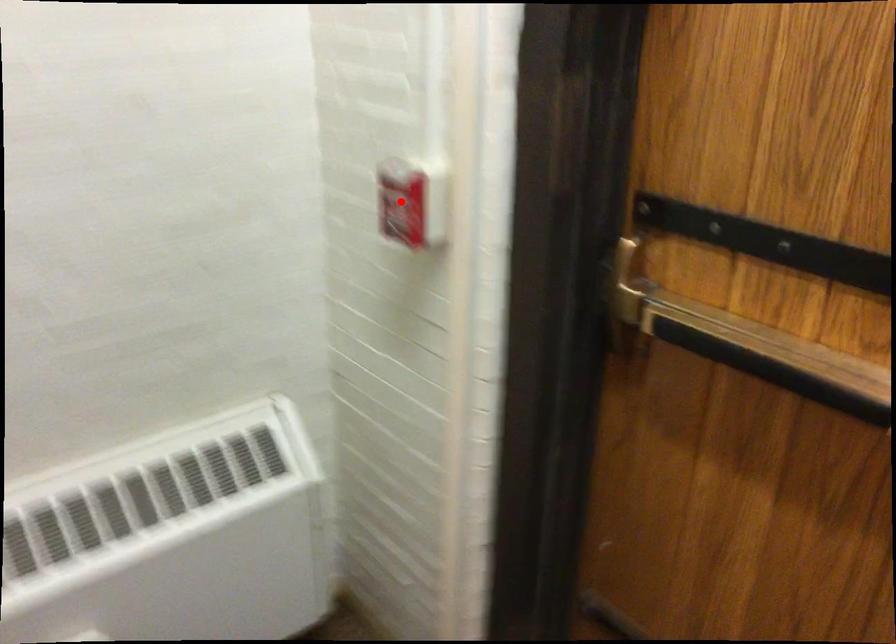
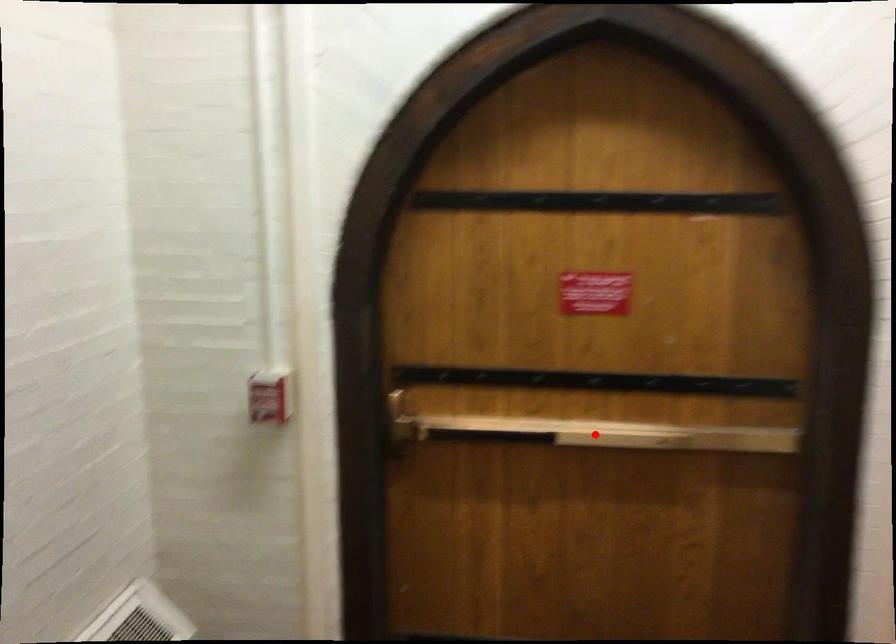
I am providing you with two images of the same scene from different viewpoints. A red point is marked on the first image and another point is marked on the second image. Is the red point in image1 aligned with the point shown in image2?

No